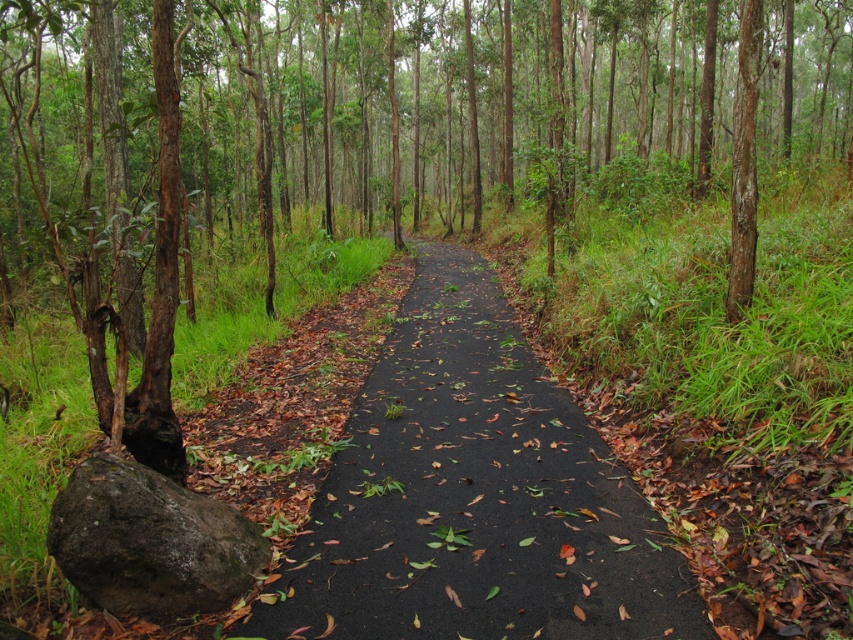
Does black asphalt path at center appear on the right side of green mossy rock at lower left?

Indeed, black asphalt path at center is positioned on the right side of green mossy rock at lower left.

Which of these two, black asphalt path at center or green mossy rock at lower left, stands taller?

green mossy rock at lower left is taller.

Where is `black asphalt path at center`? The height and width of the screenshot is (640, 853). black asphalt path at center is located at coordinates pos(473,497).